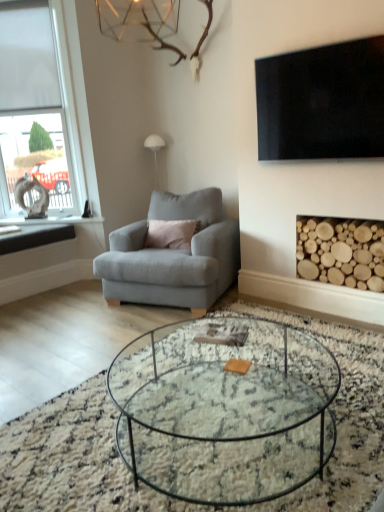
Question: From a real-world perspective, is black glossy tv at upper right physically below clear glass coffee table at center?

Choices:
 (A) no
 (B) yes

Answer: (A)

Question: Could you tell me if black glossy tv at upper right is facing clear glass coffee table at center?

Choices:
 (A) yes
 (B) no

Answer: (B)

Question: From a real-world perspective, is black glossy tv at upper right positioned over clear glass coffee table at center based on gravity?

Choices:
 (A) yes
 (B) no

Answer: (A)

Question: Can you confirm if black glossy tv at upper right is smaller than clear glass coffee table at center?

Choices:
 (A) no
 (B) yes

Answer: (B)

Question: From the image's perspective, is black glossy tv at upper right located beneath clear glass coffee table at center?

Choices:
 (A) yes
 (B) no

Answer: (B)

Question: Based on their positions, is matte gray armchair at center located to the left or right of black stone window sill at left?

Choices:
 (A) right
 (B) left

Answer: (A)

Question: From a real-world perspective, relative to black stone window sill at left, is matte gray armchair at center vertically above or below?

Choices:
 (A) above
 (B) below

Answer: (B)

Question: From their relative heights in the image, would you say matte gray armchair at center is taller or shorter than black stone window sill at left?

Choices:
 (A) short
 (B) tall

Answer: (B)

Question: Considering the positions of matte gray armchair at center and black stone window sill at left in the image, is matte gray armchair at center wider or thinner than black stone window sill at left?

Choices:
 (A) wide
 (B) thin

Answer: (B)

Question: Is black glossy tv at upper right taller or shorter than matte gray armchair at center?

Choices:
 (A) short
 (B) tall

Answer: (A)

Question: From a real-world perspective, relative to matte gray armchair at center, is black glossy tv at upper right vertically above or below?

Choices:
 (A) below
 (B) above

Answer: (B)

Question: Is black glossy tv at upper right inside or outside of matte gray armchair at center?

Choices:
 (A) outside
 (B) inside

Answer: (A)

Question: In terms of size, does black glossy tv at upper right appear bigger or smaller than matte gray armchair at center?

Choices:
 (A) small
 (B) big

Answer: (A)

Question: Is clear glass coffee table at center inside or outside of white frosted glass window at left?

Choices:
 (A) outside
 (B) inside

Answer: (A)

Question: Considering the positions of clear glass coffee table at center and white frosted glass window at left in the image, is clear glass coffee table at center taller or shorter than white frosted glass window at left?

Choices:
 (A) short
 (B) tall

Answer: (A)